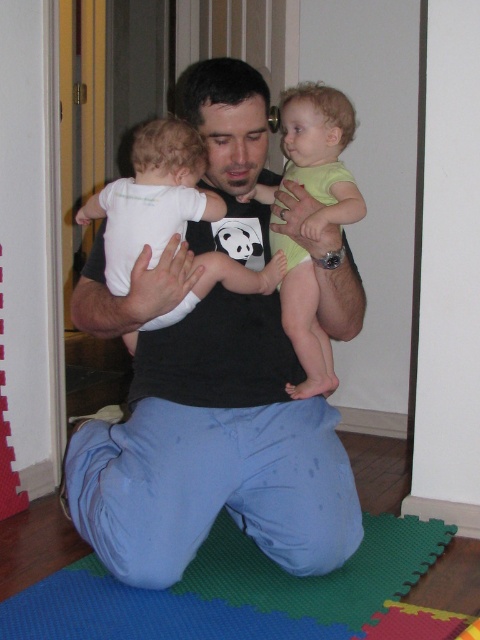
You are a photographer setting up for a family photo. You need to ensure the black cotton shirt at center and the light green fabric toddler at center are both visible in the frame. Given their sizes, which object should you focus on to ensure both are in focus?

The black cotton shirt at center is larger than the light green fabric toddler at center, so focusing on the black cotton shirt at center will help ensure both are in focus since it is the larger object.